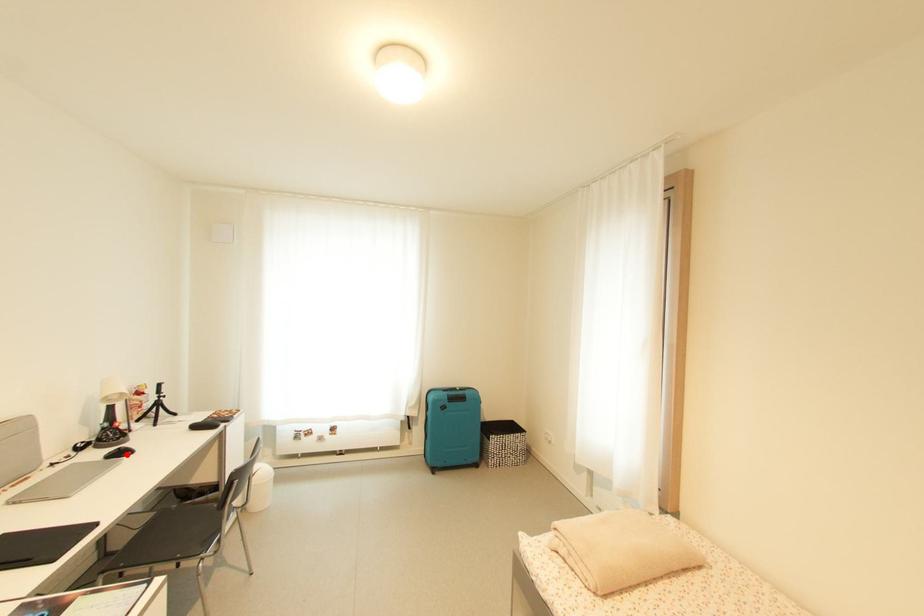
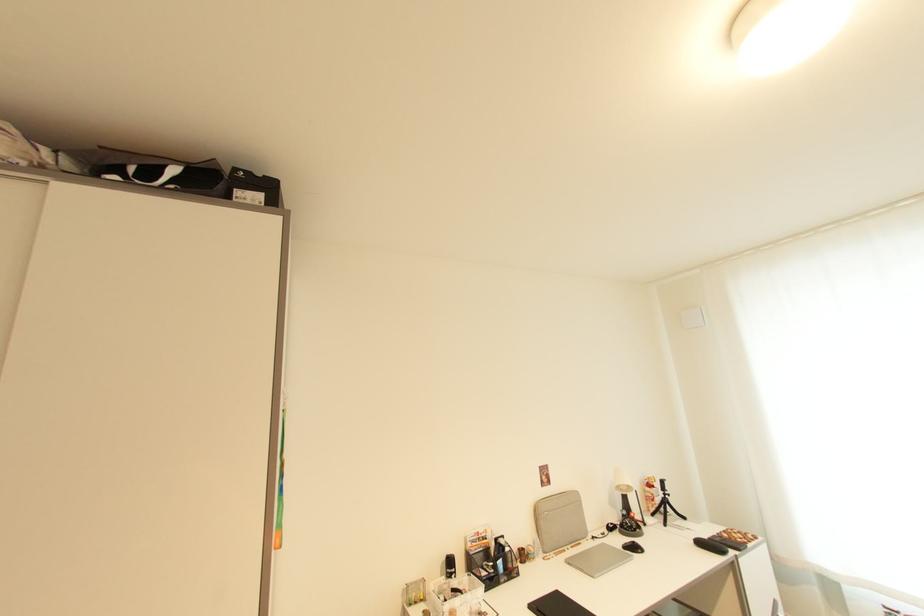
The point at the highlighted location is marked in the first image. Where is the corresponding point in the second image?

(639, 549)